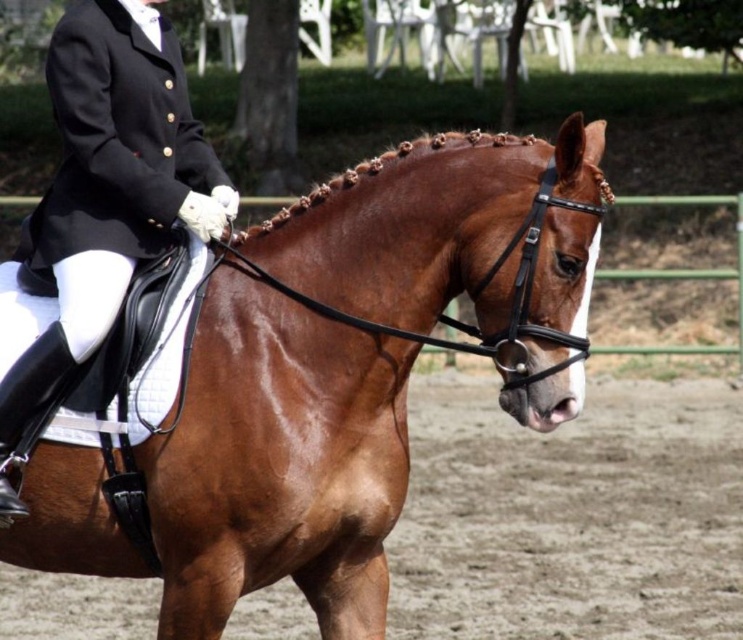
Who is more forward, (x=516, y=600) or (x=146, y=208)?

Point (x=146, y=208) is in front.

How much distance is there between brown dirt field at center and black leather jacket at upper left?

They are 22.18 feet apart.

Which is in front, point (585, 520) or point (155, 113)?

Point (155, 113)

I want to click on brown dirt field at center, so click(x=571, y=515).

Who is lower down, shiny brown horse at center or black leather jacket at upper left?

shiny brown horse at center

Is point (221, 346) more distant than point (87, 29)?

No, (221, 346) is in front of (87, 29).

The height and width of the screenshot is (640, 743). Find the location of `shiny brown horse at center`. shiny brown horse at center is located at coordinates (363, 364).

Based on the photo, is shiny brown horse at center closer to camera compared to brown dirt field at center?

Yes, shiny brown horse at center is closer to the viewer.

The width and height of the screenshot is (743, 640). In order to click on shiny brown horse at center in this screenshot , I will do coord(363,364).

Identify the location of shiny brown horse at center. Image resolution: width=743 pixels, height=640 pixels. (363, 364).